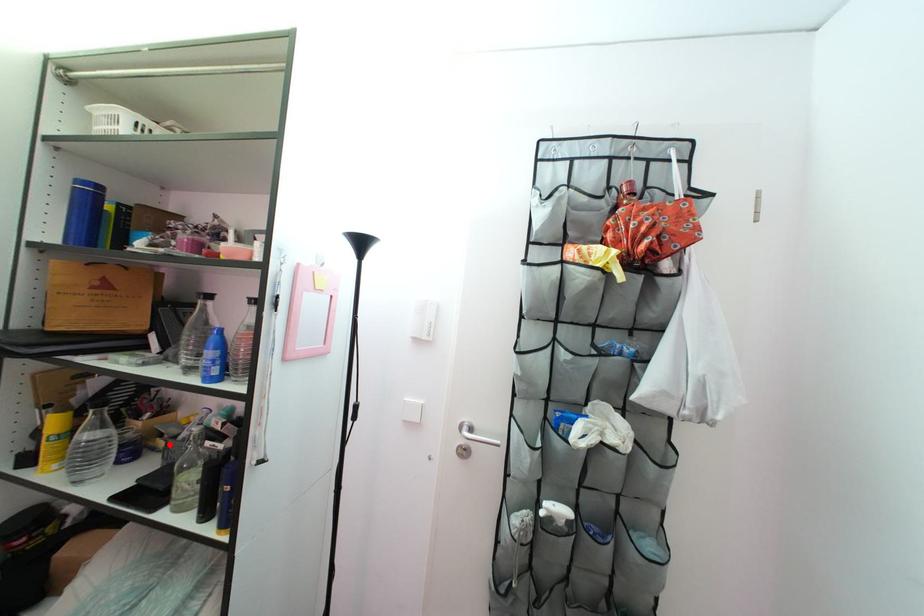
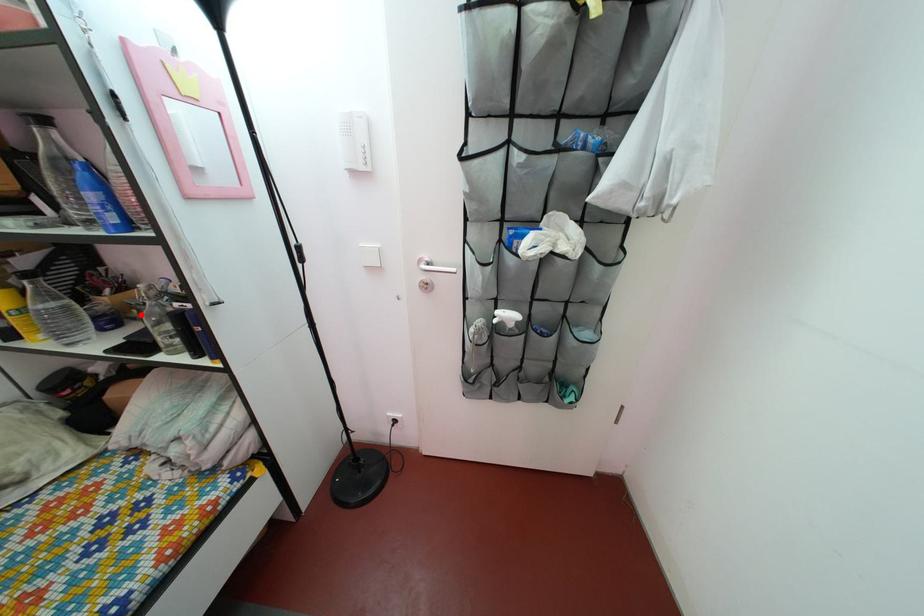
I am providing you with two images of the same scene from different viewpoints. A red point is marked on the first image and another point is marked on the second image. Is the red point in image1 aligned with the point shown in image2?

Yes